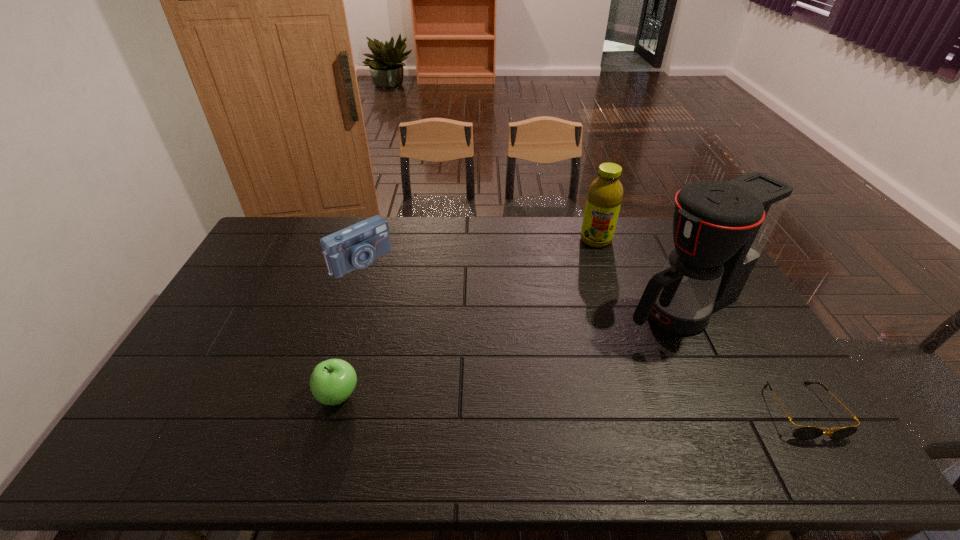
You are a GUI agent. You are given a task and a screenshot of the screen. Output one action in this format:
    pyautogui.click(x=<x>, y=<y>)
    Task: Click on the sunglasses that is at the right edge
    The image size is (960, 540).
    Given the screenshot: What is the action you would take?
    pyautogui.click(x=804, y=432)

Where is `coffee maker at the right edge`? Image resolution: width=960 pixels, height=540 pixels. coffee maker at the right edge is located at coordinates (720, 229).

The width and height of the screenshot is (960, 540). I want to click on object at the near right corner, so click(x=804, y=432).

This screenshot has height=540, width=960. In the image, there is a desktop. Identify the location of free space at the far edge. (392, 234).

This screenshot has width=960, height=540. I want to click on vacant space at the near edge, so click(708, 414).

In the image, there is a desktop. Identify the location of free space at the left edge. The image size is (960, 540). (244, 305).

In the image, there is a desktop. Identify the location of vacant space at the far left corner. The width and height of the screenshot is (960, 540). (285, 218).

Image resolution: width=960 pixels, height=540 pixels. Find the location of `vacant area at the near left corner of the desktop`. vacant area at the near left corner of the desktop is located at coordinates (171, 420).

This screenshot has width=960, height=540. Find the location of `empty location between the coffee maker and the apple`. empty location between the coffee maker and the apple is located at coordinates (510, 352).

Where is `vacant point located between the tallest object and the shortest object`? vacant point located between the tallest object and the shortest object is located at coordinates (742, 360).